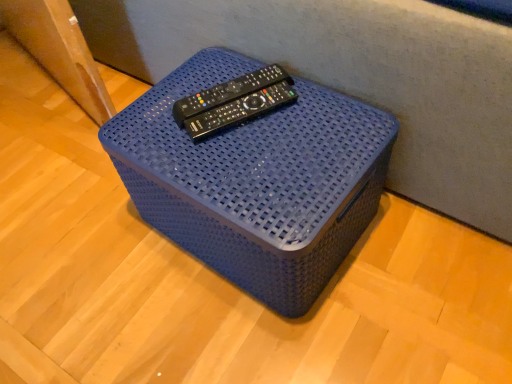
Question: Is point (325, 175) closer or farther from the camera than point (200, 114)?

Choices:
 (A) closer
 (B) farther

Answer: (A)

Question: From the image's perspective, is blue woven basket at center located above or below black plastic remote at center?

Choices:
 (A) above
 (B) below

Answer: (B)

Question: From their relative heights in the image, would you say blue woven basket at center is taller or shorter than black plastic remote at center?

Choices:
 (A) tall
 (B) short

Answer: (A)

Question: Would you say black plastic remote at center is to the left or to the right of blue woven basket at center in the picture?

Choices:
 (A) right
 (B) left

Answer: (B)

Question: Considering the positions of black plastic remote at center and blue woven basket at center in the image, is black plastic remote at center wider or thinner than blue woven basket at center?

Choices:
 (A) thin
 (B) wide

Answer: (A)

Question: Looking at the image, does black plastic remote at center seem bigger or smaller compared to blue woven basket at center?

Choices:
 (A) big
 (B) small

Answer: (B)

Question: From the image's perspective, is black plastic remote at center positioned above or below blue woven basket at center?

Choices:
 (A) below
 (B) above

Answer: (B)